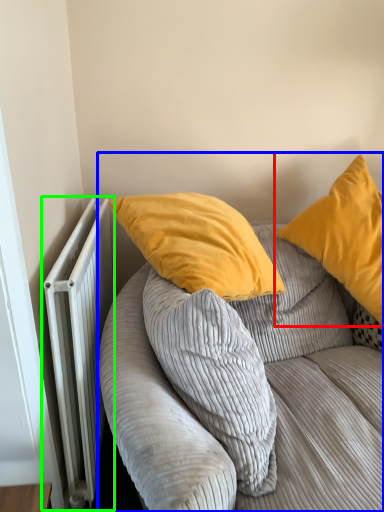
Question: Estimate the real-world distances between objects in this image. Which object is closer to pillow (highlighted by a red box), studio couch (highlighted by a blue box) or radiator (highlighted by a green box)?

Choices:
 (A) studio couch
 (B) radiator

Answer: (A)